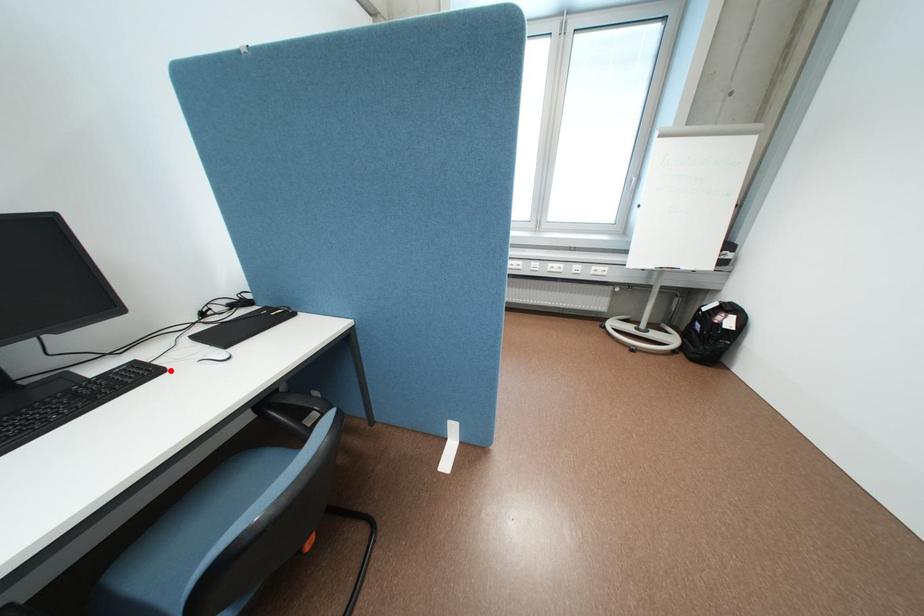
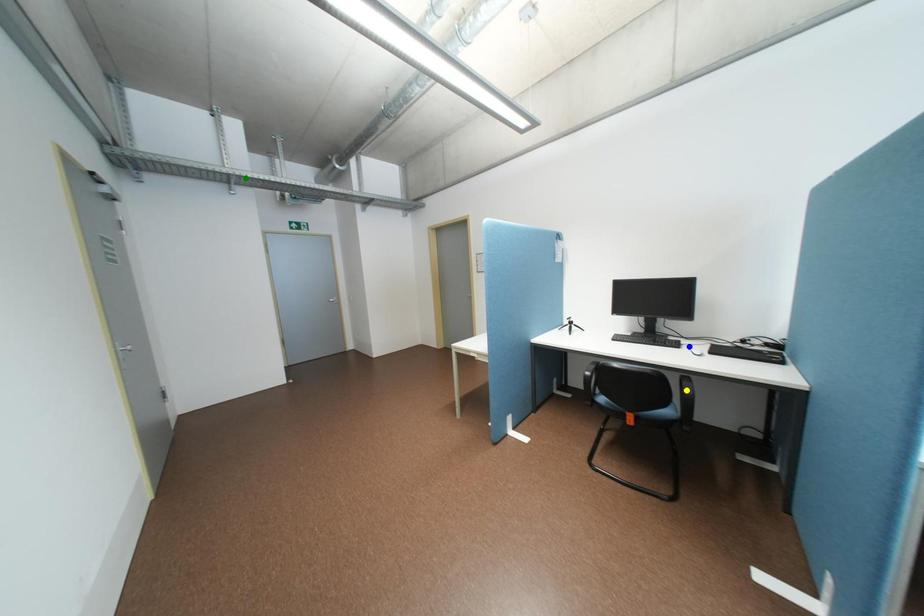
Question: I am providing you with two images of the same scene from different viewpoints. A red point is marked on the first image. You are given multiple points on the second image. Can you choose the point in image 2 that corresponds to the point in image 1?

Choices:
 (A) blue point
 (B) green point
 (C) yellow point

Answer: (A)